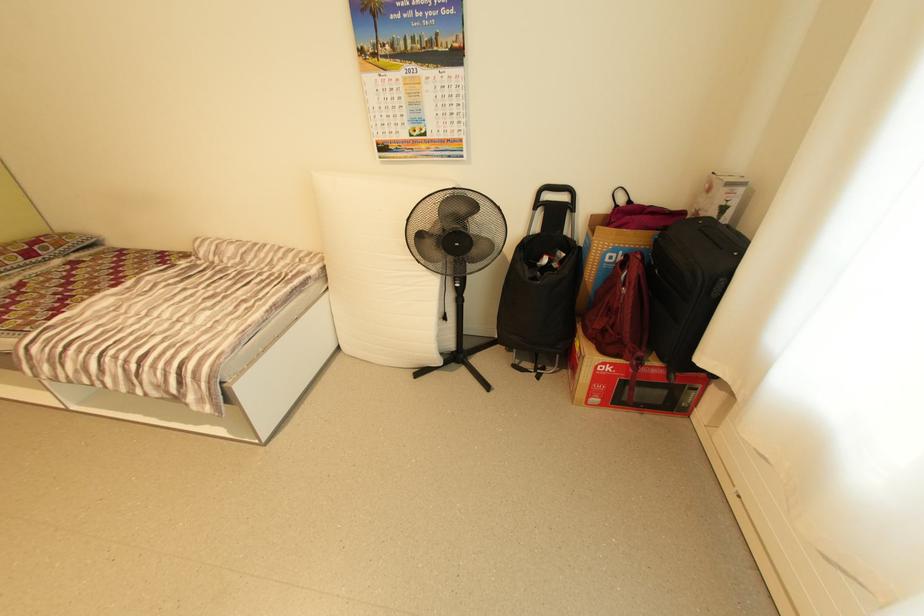
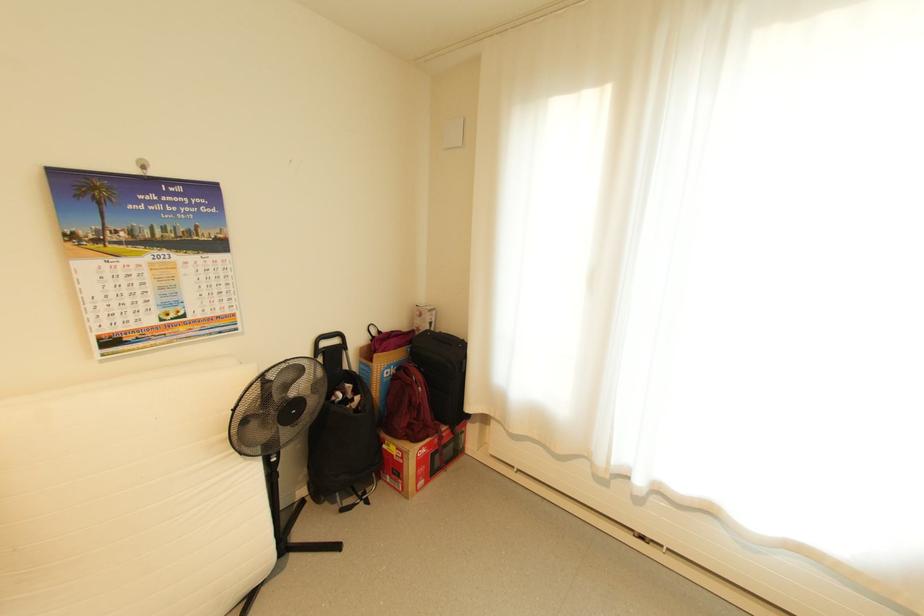
Question: The camera is either moving clockwise (left) or counter-clockwise (right) around the object. The first image is from the beginning of the video and the second image is from the end. Is the camera moving left or right when shooting the video?

Choices:
 (A) Left
 (B) Right

Answer: (A)